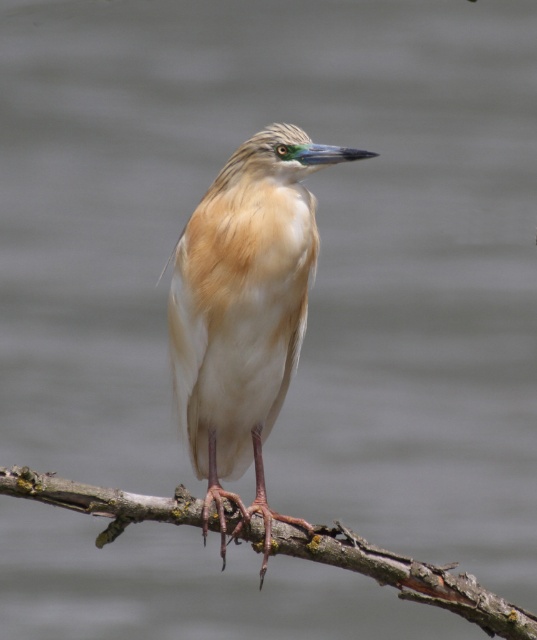
Can you confirm if light brown feathered bird at center is positioned above brown rough branch at center?

Yes, light brown feathered bird at center is above brown rough branch at center.

Can you confirm if light brown feathered bird at center is wider than brown rough branch at center?

In fact, light brown feathered bird at center might be narrower than brown rough branch at center.

Does point (224, 202) lie in front of point (178, 522)?

Yes, it is in front of point (178, 522).

The width and height of the screenshot is (537, 640). I want to click on light brown feathered bird at center, so click(244, 310).